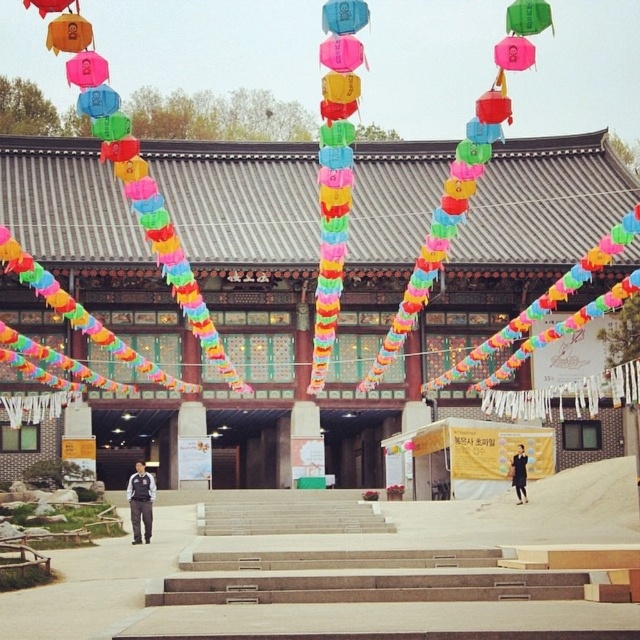
You are planning to hang a new lantern between the dark blue fabric coat at lower right and the matte orange lantern at upper left. Given that the distance between them is 44.26 meters, what is the minimum length of the string you need to ensure the new lantern can be placed exactly halfway between them?

The minimum length of the string required is 22.13 meters, as this is half of the 44.26 meters distance between the dark blue fabric coat at lower right and the matte orange lantern at upper left.

You are a visitor at this East Asian temple and want to take a photo of the dark blue uniform at center. Where should you position yourself to capture it in the frame?

To capture the dark blue uniform at center in the frame, position yourself directly in front of the dark blue uniform at center at point (140,500).

You are standing in front of the temple and want to take a photo that includes both the point at coordinates (x=150, y=477) and the point at (x=536, y=33). Which point should you focus on first to ensure both are in the frame?

You should focus on the point at (x=150, y=477) first because it is closer to you than the point at (x=536, y=33), ensuring both are within the camera frame.